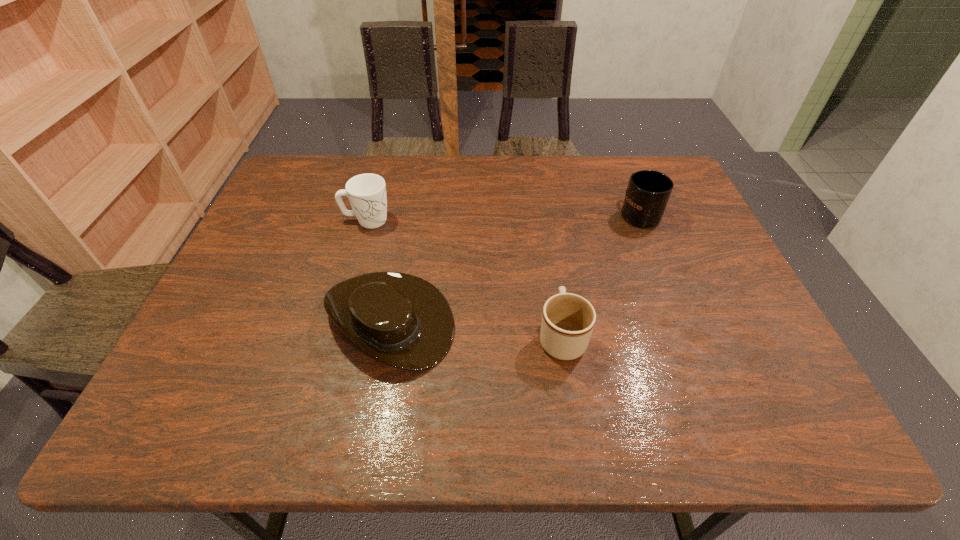
Locate an element on the screen. The height and width of the screenshot is (540, 960). the leftmost mug is located at coordinates (367, 194).

I want to click on the rightmost mug, so click(x=648, y=192).

Image resolution: width=960 pixels, height=540 pixels. I want to click on the second object from right to left, so click(568, 319).

Locate an element on the screen. the nearest mug is located at coordinates (568, 319).

Locate an element on the screen. The image size is (960, 540). the shortest object is located at coordinates (402, 320).

Identify the location of vacant space situated on the side of the leftmost mug with the handle. (420, 220).

Where is `vacant space located with the handle on the side of the rightmost mug`? Image resolution: width=960 pixels, height=540 pixels. vacant space located with the handle on the side of the rightmost mug is located at coordinates (618, 163).

Where is `vacant space located 0.170m with the handle on the side of the rightmost mug`? This screenshot has width=960, height=540. vacant space located 0.170m with the handle on the side of the rightmost mug is located at coordinates (620, 166).

Find the location of a particular element. The image size is (960, 540). free location located 0.100m with the handle on the side of the rightmost mug is located at coordinates (625, 179).

I want to click on free space located 0.210m on the side of the second mug from right to left with the handle, so click(x=548, y=249).